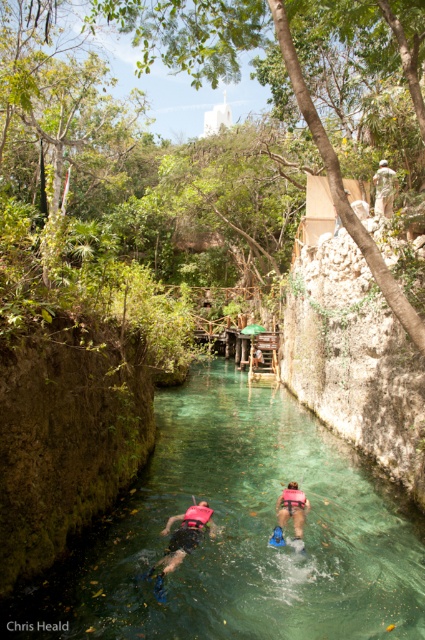
Between clear glassy water at center and pink foam vest at lower center, which one appears on the right side from the viewer's perspective?

From the viewer's perspective, clear glassy water at center appears more on the right side.

This screenshot has height=640, width=425. What do you see at coordinates (238, 534) in the screenshot? I see `clear glassy water at center` at bounding box center [238, 534].

Is point (240, 602) positioned in front of point (189, 528)?

Yes, it is.

Find the location of a particular element. The width and height of the screenshot is (425, 640). clear glassy water at center is located at coordinates (238, 534).

Does pink foam vest at center have a greater width compared to pink fabric life jacket at lower center?

Correct, the width of pink foam vest at center exceeds that of pink fabric life jacket at lower center.

Which is more to the right, pink foam vest at center or pink fabric life jacket at lower center?

Positioned to the right is pink foam vest at center.

Is point (306, 499) closer to viewer compared to point (198, 506)?

No, (306, 499) is behind (198, 506).

The image size is (425, 640). Identify the location of pink foam vest at center. (291, 508).

Can you confirm if pink foam vest at lower center is positioned to the right of camouflage fabric person at upper center?

Incorrect, pink foam vest at lower center is not on the right side of camouflage fabric person at upper center.

Is point (180, 561) closer to viewer compared to point (382, 202)?

Yes, it is.

Describe the element at coordinates (186, 534) in the screenshot. I see `pink foam vest at lower center` at that location.

I want to click on pink foam vest at lower center, so click(x=186, y=534).